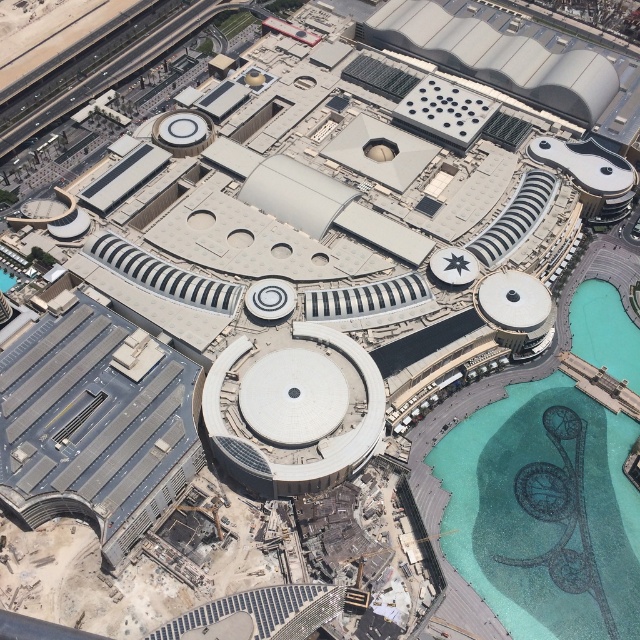
Between turquoise mosaic pool at bottom right and white matte dome at center, which one is positioned lower?

turquoise mosaic pool at bottom right

Who is higher up, turquoise mosaic pool at bottom right or white matte dome at center?

white matte dome at center is higher up.

Is point (513, 467) in front of point (532, 353)?

Yes, point (513, 467) is in front of point (532, 353).

Identify the location of turquoise mosaic pool at bottom right. (545, 513).